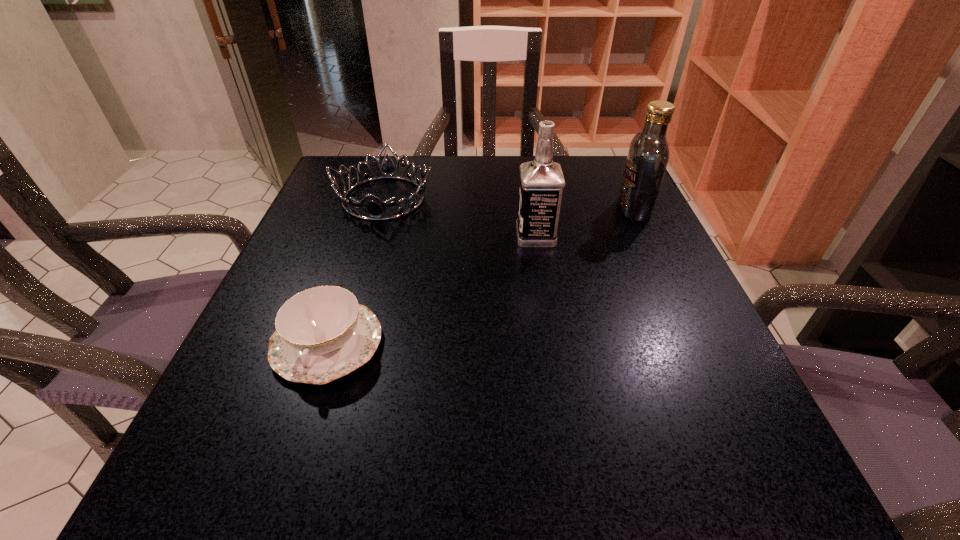
I want to click on free space that satisfies the following two spatial constraints: 1. on the front-facing side of the rightmost object; 2. on the handle side of the nearest object, so click(696, 343).

The width and height of the screenshot is (960, 540). What are the coordinates of `vacant space that satisfies the following two spatial constraints: 1. on the front-facing side of the right vodka; 2. on the handle side of the shortest object` in the screenshot? It's located at (696, 343).

Where is `blank area in the image that satisfies the following two spatial constraints: 1. on the front label of the left vodka; 2. on the handle side of the shortest object`? The height and width of the screenshot is (540, 960). blank area in the image that satisfies the following two spatial constraints: 1. on the front label of the left vodka; 2. on the handle side of the shortest object is located at coordinates (553, 343).

Where is `free location that satisfies the following two spatial constraints: 1. on the front label of the second object from right to left; 2. on the handle side of the shortest object`? The image size is (960, 540). free location that satisfies the following two spatial constraints: 1. on the front label of the second object from right to left; 2. on the handle side of the shortest object is located at coordinates (553, 343).

The width and height of the screenshot is (960, 540). Identify the location of free location that satisfies the following two spatial constraints: 1. on the front label of the nearer vodka; 2. on the handle side of the shortest object. (553, 343).